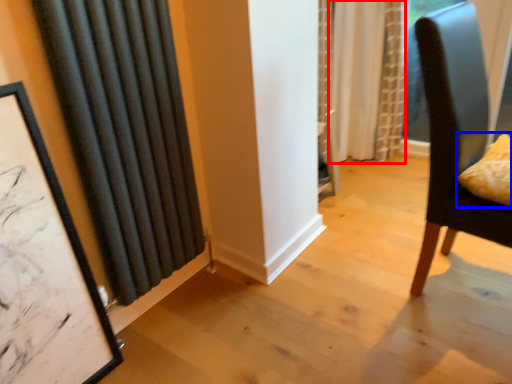
Question: Which of the following is the closest to the observer, curtain (highlighted by a red box) or pillow (highlighted by a blue box)?

Choices:
 (A) curtain
 (B) pillow

Answer: (B)